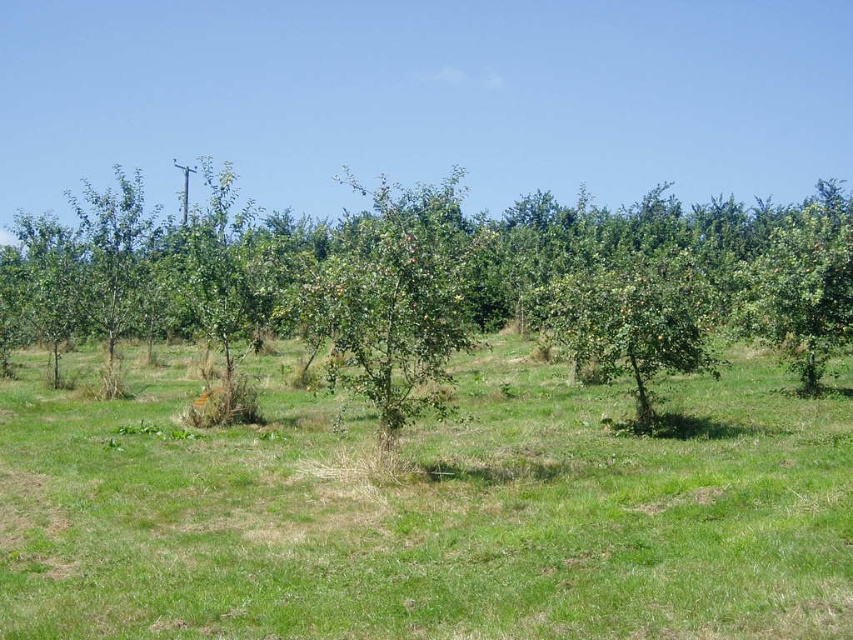
You are standing in the orchard and want to walk from the green grass at center to the green leafy tree at center. Which direction should you move to reach the tree?

You should move to the right from the green grass at center because it is to the left of the green leafy tree at center.

You are standing at the edge of the orchard looking towards the rows of young fruit trees. There is a point marked at coordinates (428, 513) in the image. What is located at this point?

The point at coordinates (428, 513) marks green grass at center.

You are standing at the edge of the orchard and want to walk to the middle of the field. Is there any green grass at center where you will arrive?

Yes, there is green grass at center at point (428, 513), so you can walk there safely.